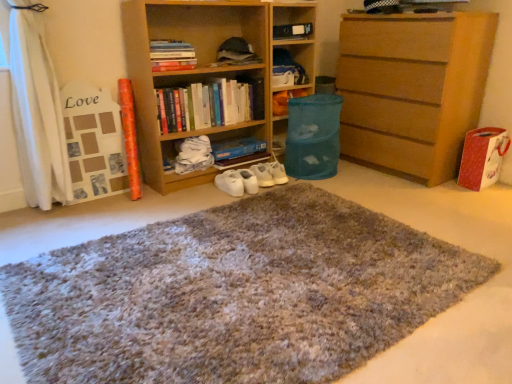
What are the coordinates of `free space in front of light brown wooden chest of drawers at right` in the screenshot? It's located at (415, 198).